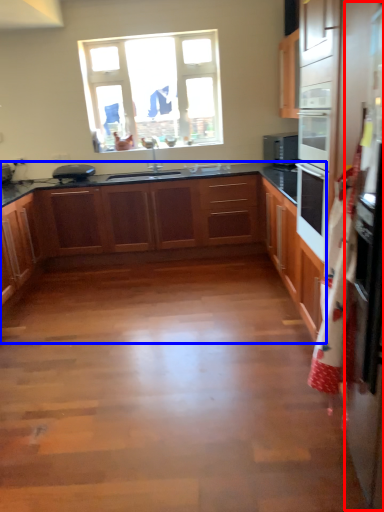
Question: Which object is further to the camera taking this photo, fridge (highlighted by a red box) or cabinetry (highlighted by a blue box)?

Choices:
 (A) fridge
 (B) cabinetry

Answer: (B)